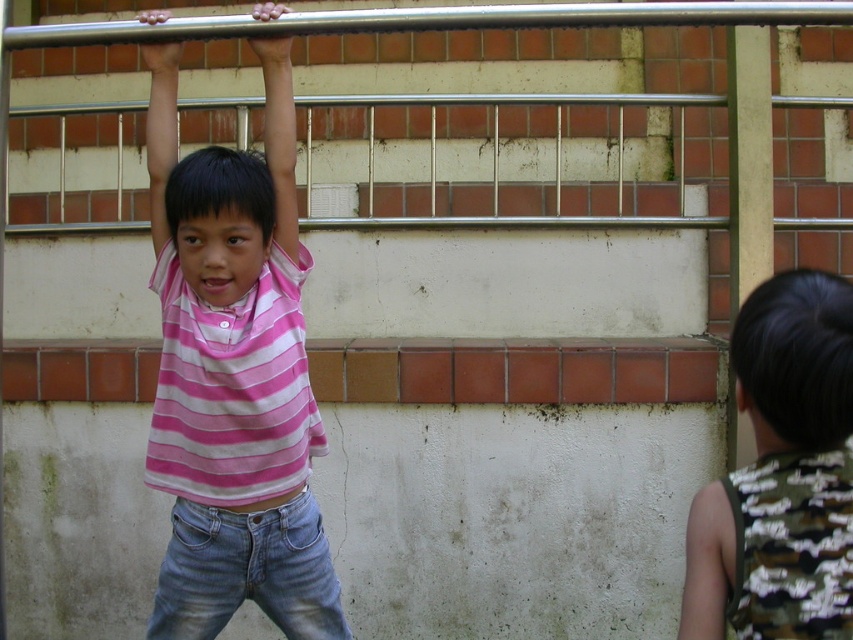
Question: Considering the relative positions of camouflage fabric shirt at right and denim jeans at lower center in the image provided, where is camouflage fabric shirt at right located with respect to denim jeans at lower center?

Choices:
 (A) right
 (B) left

Answer: (A)

Question: Is camouflage fabric shirt at right above denim jeans at lower center?

Choices:
 (A) no
 (B) yes

Answer: (B)

Question: Estimate the real-world distances between objects in this image. Which object is closer to the camouflage fabric shirt at right?

Choices:
 (A) pink striped shirt at center
 (B) denim jeans at lower center

Answer: (A)

Question: Among these objects, which one is nearest to the camera?

Choices:
 (A) camouflage fabric shirt at right
 (B) pink striped shirt at center
 (C) denim jeans at lower center

Answer: (A)

Question: Which of the following is the closest to the observer?

Choices:
 (A) (x=335, y=593)
 (B) (x=757, y=570)

Answer: (B)

Question: Can you confirm if pink striped shirt at center is positioned to the right of denim jeans at lower center?

Choices:
 (A) no
 (B) yes

Answer: (A)